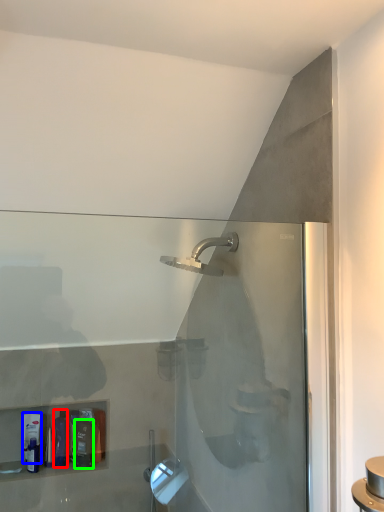
Question: Considering the real-world distances, which object is farthest from toiletry (highlighted by a red box)? toiletry (highlighted by a blue box) or toiletry (highlighted by a green box)?

Choices:
 (A) toiletry
 (B) toiletry

Answer: (A)